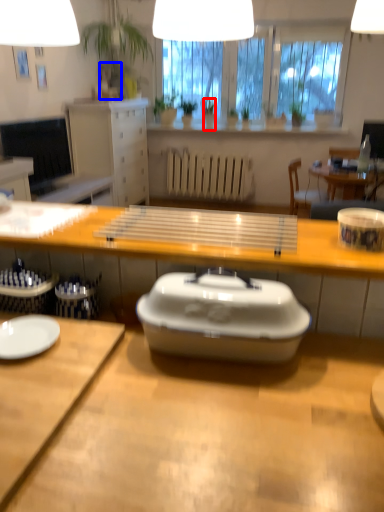
Question: Which of the following is the farthest to the observer, houseplant (highlighted by a red box) or vase (highlighted by a blue box)?

Choices:
 (A) houseplant
 (B) vase

Answer: (B)